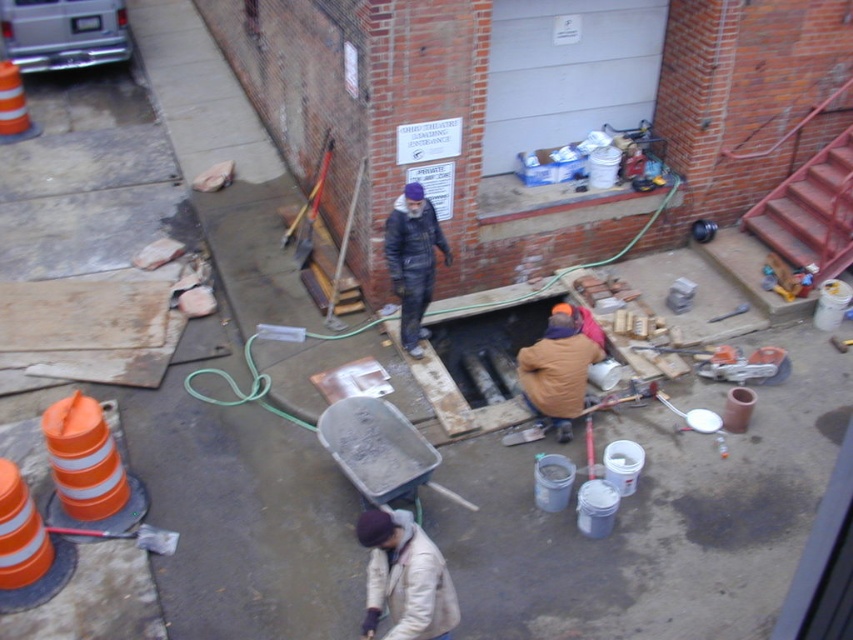
You are a safety inspector at the construction site. You need to ensure that the white matte jacket at lower center and the orange reflective traffic cone at left are visible to workers. Considering their sizes, which object might be harder to notice from a distance?

The orange reflective traffic cone at left is smaller in width compared to the white matte jacket at lower center, so the traffic cone might be harder to notice from a distance because it is narrower.

You are a safety inspector at the construction site. You need to check the safety gear of two workers. One is wearing a white matte jacket at lower center and the other is wearing dark blue denim overalls at center. Which worker is positioned to the left when viewed from your perspective?

The white matte jacket at lower center is positioned to the left of the dark blue denim overalls at center.